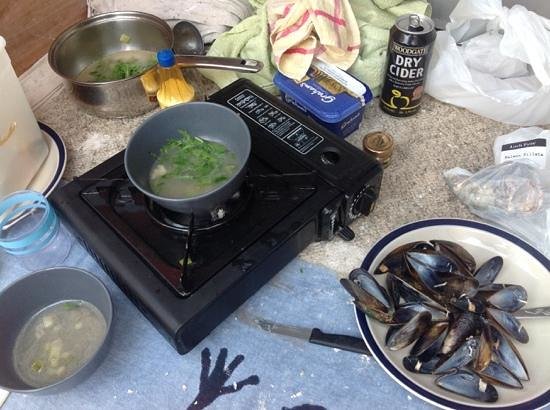
Identify the location of gas power stove. The height and width of the screenshot is (410, 550). (299, 143).